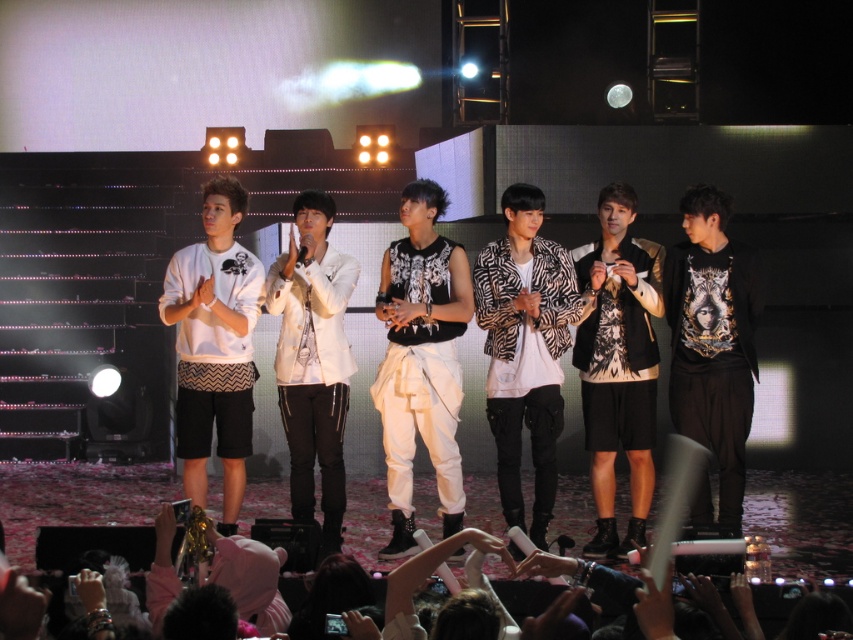
Looking at this image, is white zigzag-patterned shorts at left taller than white matte jacket at center?

No.

What do you see at coordinates (213, 346) in the screenshot?
I see `white zigzag-patterned shorts at left` at bounding box center [213, 346].

Does point (189, 273) come farther from viewer compared to point (286, 349)?

No, (189, 273) is in front of (286, 349).

The image size is (853, 640). What are the coordinates of `white zigzag-patterned shorts at left` in the screenshot? It's located at (213, 346).

Is printed jersey at center behind white zigzag-patterned shorts at left?

No, it is in front of white zigzag-patterned shorts at left.

Identify the location of printed jersey at center. The image size is (853, 640). (618, 365).

Image resolution: width=853 pixels, height=640 pixels. Find the location of `printed jersey at center`. printed jersey at center is located at coordinates (618, 365).

Locate an element on the screen. This screenshot has width=853, height=640. printed jersey at center is located at coordinates (618, 365).

Can you confirm if zebra-patterned jacket at center is positioned to the left of white zigzag-patterned shorts at left?

Incorrect, zebra-patterned jacket at center is not on the left side of white zigzag-patterned shorts at left.

Is point (567, 257) positioned in front of point (230, 266)?

No, (567, 257) is further to viewer.

Find the location of a particular element. zebra-patterned jacket at center is located at coordinates (524, 349).